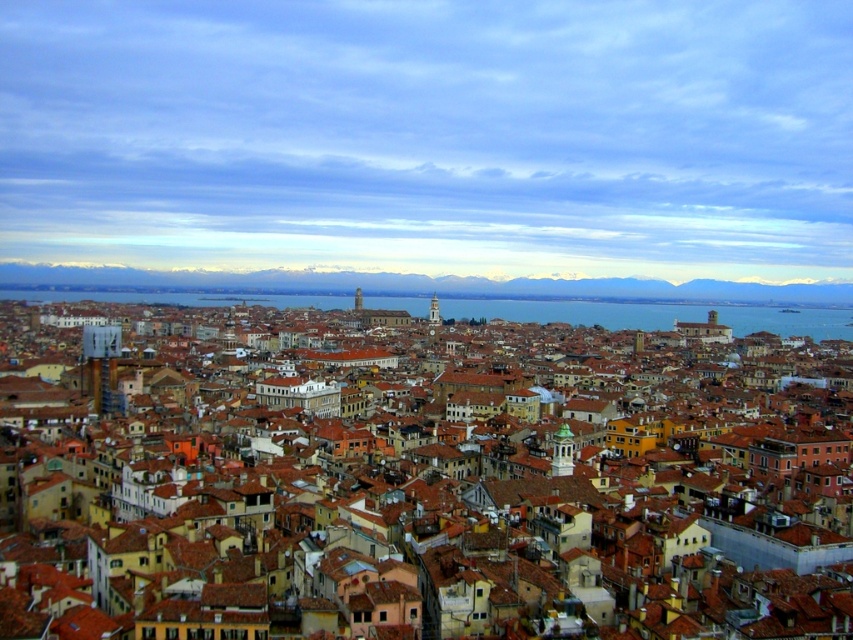
You are standing in the historic city and want to locate the blue water at center. From your current position, which direction should you move to reach it from the brown tiled roofs at center?

To reach the blue water at center from the brown tiled roofs at center, you should move to the right since the brown tiled roofs at center are located to the left of the blue water at center.